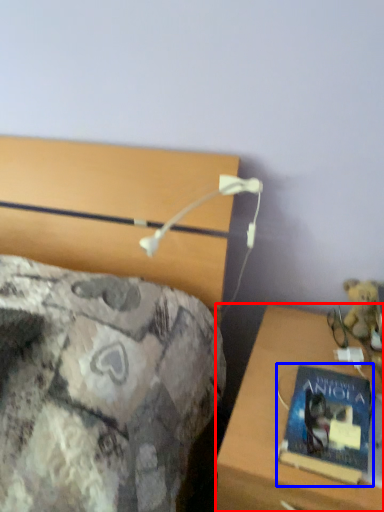
Question: Which point is further to the camera, desk (highlighted by a red box) or book (highlighted by a blue box)?

Choices:
 (A) desk
 (B) book

Answer: (B)